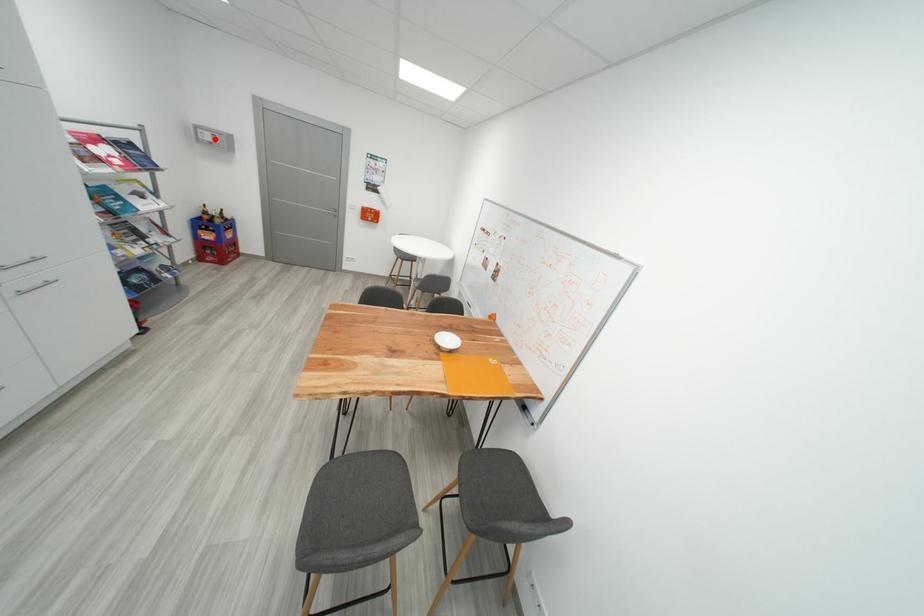
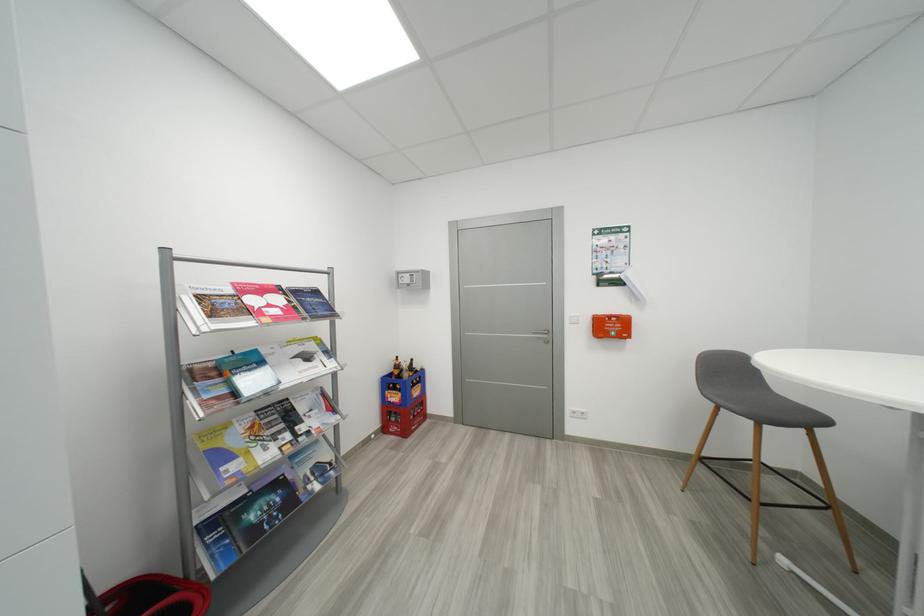
Where in the second image is the point corresponding to the highlighted location from the first image?

(412, 282)